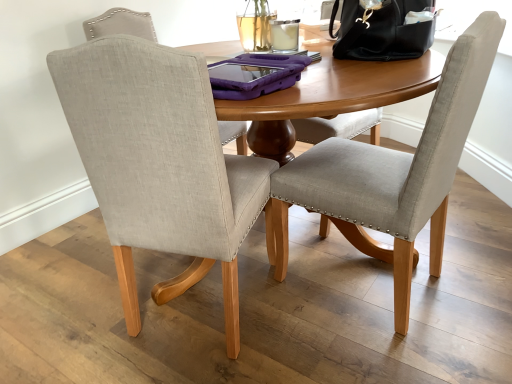
Locate an element on the screen. The image size is (512, 384). vacant area that lies in front of light gray fabric chair at center, arranged as the 2th chair when viewed from the left is located at coordinates (388, 350).